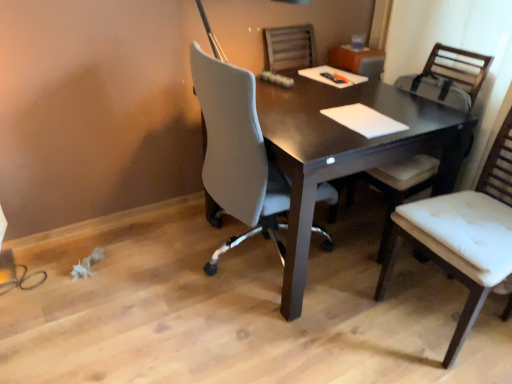
Where is `free space in front of dark wood desk at center`? The height and width of the screenshot is (384, 512). free space in front of dark wood desk at center is located at coordinates (292, 345).